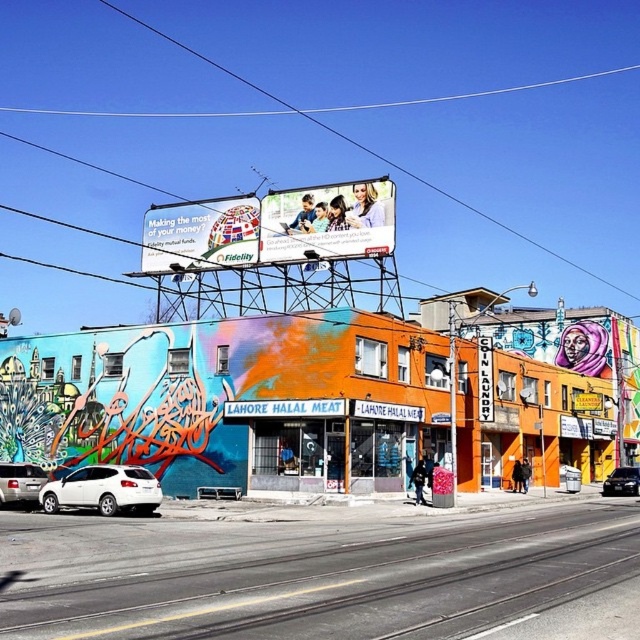
Question: Does white paper billboard at upper center appear on the left side of white matte suv at lower left?

Choices:
 (A) no
 (B) yes

Answer: (B)

Question: Which point is closer to the camera taking this photo?

Choices:
 (A) (468, 244)
 (B) (113, 508)
 (C) (628, 467)

Answer: (B)

Question: Estimate the real-world distances between objects in this image. Which object is closer to the orange painted sign at center?

Choices:
 (A) metallic wire at upper center
 (B) white matte suv at lower left

Answer: (B)

Question: Which object is the closest to the white matte suv at lower left?

Choices:
 (A) orange painted sign at center
 (B) white paper billboard at upper center
 (C) metallic wire at upper center

Answer: (A)

Question: Considering the relative positions of orange painted sign at center and black glossy sedan at center in the image provided, where is orange painted sign at center located with respect to black glossy sedan at center?

Choices:
 (A) left
 (B) right

Answer: (A)

Question: Does orange painted sign at center have a greater width compared to black glossy sedan at center?

Choices:
 (A) no
 (B) yes

Answer: (A)